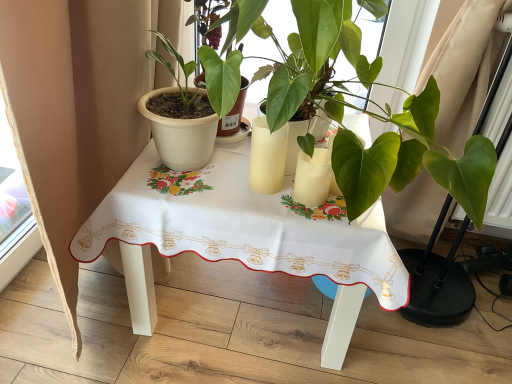
Question: Is matte yellow glass at center, the second candle holder in the right-to-left sequence, positioned behind matte white pot at left, which ranks as the second houseplant in right-to-left order?

Choices:
 (A) no
 (B) yes

Answer: (B)

Question: From the image's perspective, is matte yellow glass at center, the second candle holder in the right-to-left sequence, beneath matte white pot at left, the first houseplant viewed from the left?

Choices:
 (A) no
 (B) yes

Answer: (B)

Question: Can matte white pot at left, which ranks as the second houseplant in right-to-left order, be found inside matte yellow glass at center, the second candle holder in the right-to-left sequence?

Choices:
 (A) yes
 (B) no

Answer: (B)

Question: Is the depth of matte yellow glass at center, the second candle holder in the right-to-left sequence, less than that of matte white pot at left, which ranks as the second houseplant in right-to-left order?

Choices:
 (A) no
 (B) yes

Answer: (A)

Question: From a real-world perspective, is matte yellow glass at center, the second candle holder in the right-to-left sequence, positioned under matte white pot at left, the first houseplant viewed from the left, based on gravity?

Choices:
 (A) no
 (B) yes

Answer: (B)

Question: From the image's perspective, is green matte plant at center, positioned as the 1th houseplant in right-to-left order, above or below matte yellow glass at center, the second candle holder in the right-to-left sequence?

Choices:
 (A) below
 (B) above

Answer: (B)

Question: Does point (480, 215) appear closer or farther from the camera than point (282, 172)?

Choices:
 (A) closer
 (B) farther

Answer: (A)

Question: Is green matte plant at center, positioned as the 1th houseplant in right-to-left order, wider or thinner than matte yellow glass at center, placed as the 1th candle holder when sorted from left to right?

Choices:
 (A) wide
 (B) thin

Answer: (A)

Question: Is green matte plant at center, positioned as the 1th houseplant in right-to-left order, spatially inside matte yellow glass at center, the second candle holder in the right-to-left sequence, or outside of it?

Choices:
 (A) outside
 (B) inside

Answer: (A)

Question: From the image's perspective, is matte white candle at center, the second candle holder in the left-to-right sequence, located above or below matte yellow glass at center, the second candle holder in the right-to-left sequence?

Choices:
 (A) below
 (B) above

Answer: (A)

Question: Is point (329, 175) positioned closer to the camera than point (265, 183)?

Choices:
 (A) closer
 (B) farther

Answer: (A)

Question: Considering the positions of matte white candle at center, positioned as the 1th candle holder in right-to-left order, and matte yellow glass at center, the second candle holder in the right-to-left sequence, in the image, is matte white candle at center, positioned as the 1th candle holder in right-to-left order, bigger or smaller than matte yellow glass at center, the second candle holder in the right-to-left sequence,?

Choices:
 (A) big
 (B) small

Answer: (B)

Question: From a real-world perspective, is matte white candle at center, positioned as the 1th candle holder in right-to-left order, positioned above or below matte yellow glass at center, placed as the 1th candle holder when sorted from left to right?

Choices:
 (A) below
 (B) above

Answer: (A)

Question: In terms of size, does green matte plant at center, positioned as the 1th houseplant in right-to-left order, appear bigger or smaller than matte white pot at left, which ranks as the second houseplant in right-to-left order?

Choices:
 (A) small
 (B) big

Answer: (B)

Question: Is green matte plant at center, positioned as the 1th houseplant in right-to-left order, taller or shorter than matte white pot at left, which ranks as the second houseplant in right-to-left order?

Choices:
 (A) short
 (B) tall

Answer: (B)